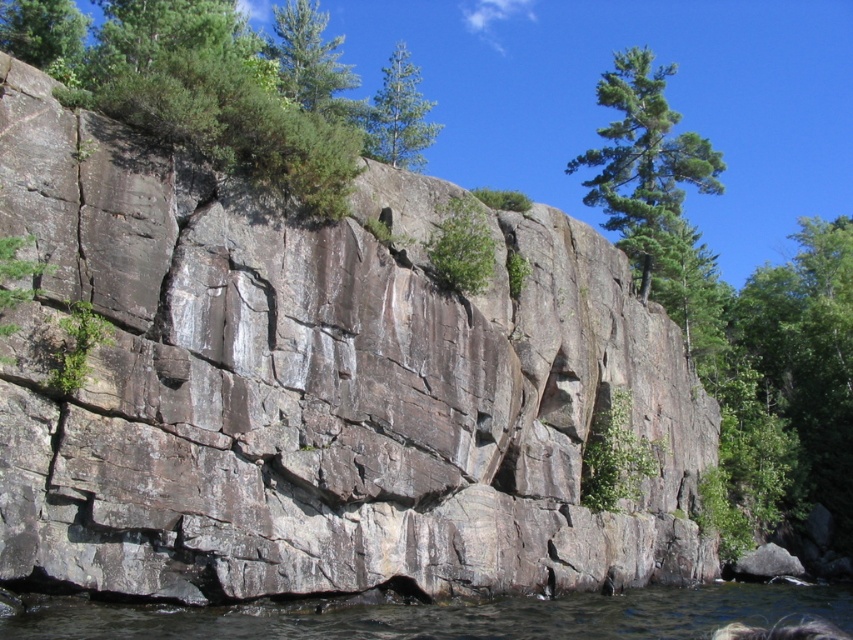
Who is positioned more to the left, clear water at lower center or green leafy tree at upper left?

green leafy tree at upper left

Who is more distant from viewer, (451, 632) or (64, 33)?

Positioned behind is point (64, 33).

Does point (352, 634) come closer to viewer compared to point (30, 42)?

Yes, it is.

You are a GUI agent. You are given a task and a screenshot of the screen. Output one action in this format:
    pyautogui.click(x=<x>, y=<y>)
    Task: Click on the clear water at lower center
    This screenshot has width=853, height=640.
    Given the screenshot: What is the action you would take?
    pyautogui.click(x=456, y=616)

Which is below, green matte tree at center or green leafy tree at upper center?

green leafy tree at upper center is below.

Is green matte tree at center closer to the viewer compared to green leafy tree at upper center?

No, green matte tree at center is behind green leafy tree at upper center.

Which is behind, point (426, 132) or point (454, 276)?

Positioned behind is point (426, 132).

The image size is (853, 640). What are the coordinates of `green matte tree at center` in the screenshot? It's located at (399, 115).

Can you confirm if green textured tree at upper right is thinner than green leafy tree at upper center?

No, green textured tree at upper right is not thinner than green leafy tree at upper center.

Can you confirm if green textured tree at upper right is positioned below green leafy tree at upper center?

Actually, green textured tree at upper right is above green leafy tree at upper center.

Is point (643, 179) less distant than point (457, 236)?

No, (643, 179) is further to viewer.

Locate an element on the screen. This screenshot has height=640, width=853. green textured tree at upper right is located at coordinates (643, 161).